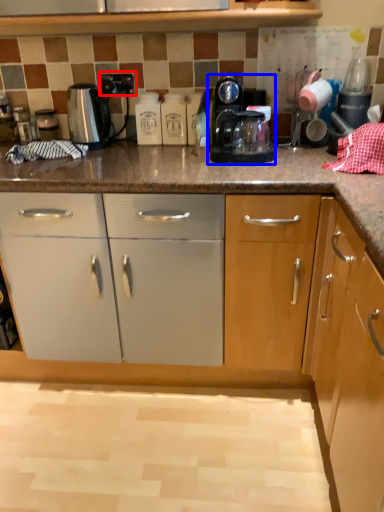
Question: Which object appears farthest to the camera in this image, electric outlet (highlighted by a red box) or home appliance (highlighted by a blue box)?

Choices:
 (A) electric outlet
 (B) home appliance

Answer: (A)